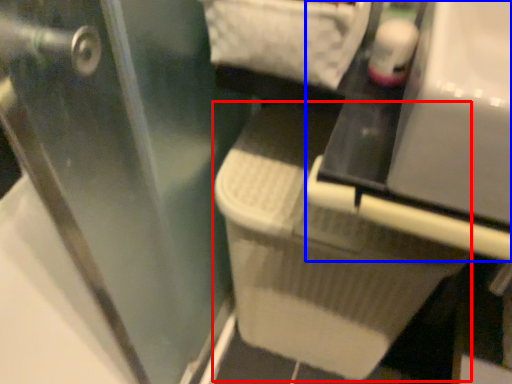
Question: Which object appears closest to the camera in this image, laundry basket (highlighted by a red box) or vanity (highlighted by a blue box)?

Choices:
 (A) laundry basket
 (B) vanity

Answer: (B)